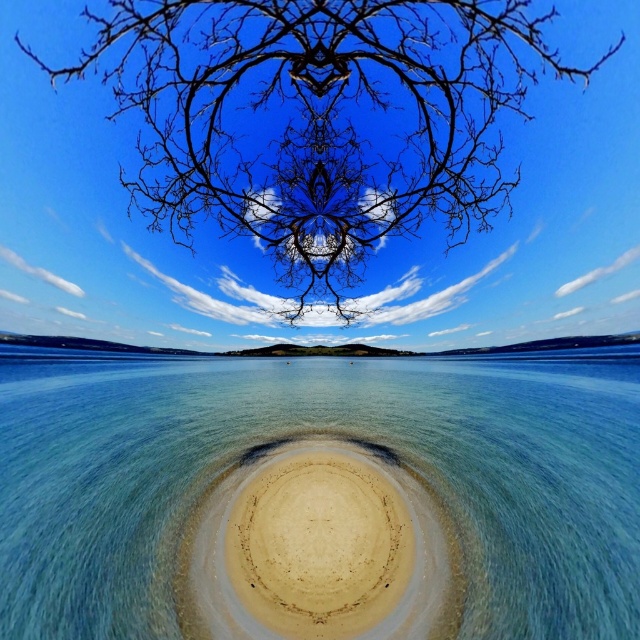
Question: Which object appears farthest from the camera in this image?

Choices:
 (A) black matte tree at upper center
 (B) beige sandy island at center
 (C) clear water at center

Answer: (A)

Question: Does black matte tree at upper center appear under beige sandy island at center?

Choices:
 (A) yes
 (B) no

Answer: (B)

Question: Does black matte tree at upper center appear on the right side of beige sandy island at center?

Choices:
 (A) no
 (B) yes

Answer: (B)

Question: Is clear water at center bigger than beige sandy island at center?

Choices:
 (A) yes
 (B) no

Answer: (A)

Question: Which is farther from the black matte tree at upper center?

Choices:
 (A) beige sandy island at center
 (B) clear water at center

Answer: (B)

Question: Which of these objects is positioned closest to the clear water at center?

Choices:
 (A) black matte tree at upper center
 (B) beige sandy island at center

Answer: (B)